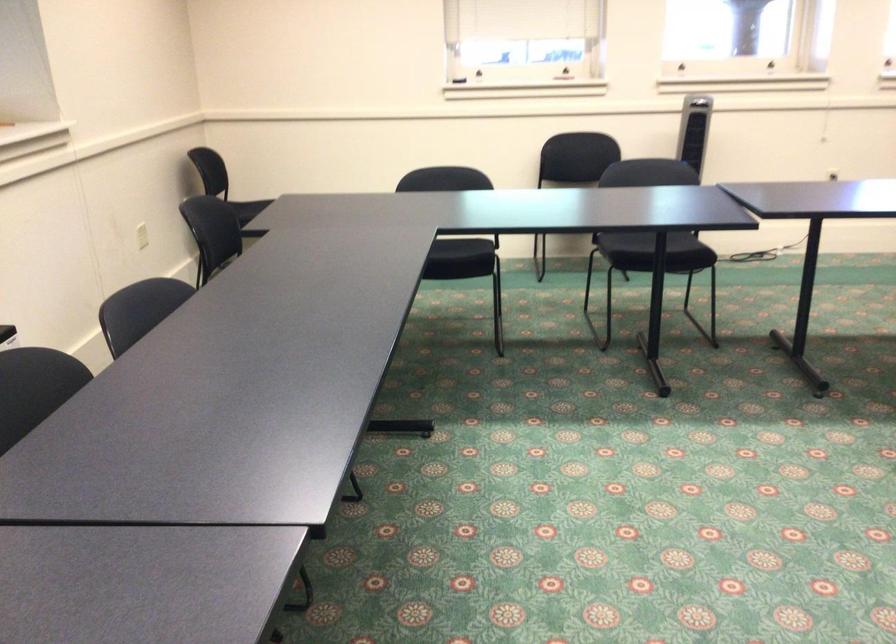
This screenshot has width=896, height=644. I want to click on white electrical outlet, so pyautogui.click(x=142, y=236).